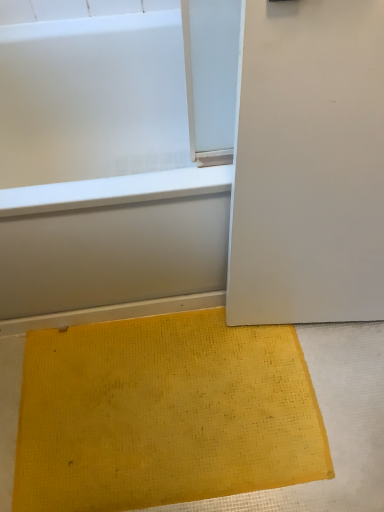
Question: Considering the positions of white glossy bathtub at lower left and yellow woven mat at lower center in the image, is white glossy bathtub at lower left taller or shorter than yellow woven mat at lower center?

Choices:
 (A) tall
 (B) short

Answer: (A)

Question: From a real-world perspective, is white glossy bathtub at lower left positioned above or below yellow woven mat at lower center?

Choices:
 (A) above
 (B) below

Answer: (A)

Question: Does point (36, 219) appear closer or farther from the camera than point (46, 347)?

Choices:
 (A) farther
 (B) closer

Answer: (B)

Question: From a real-world perspective, is yellow woven mat at lower center above or below white glossy bathtub at lower left?

Choices:
 (A) below
 (B) above

Answer: (A)

Question: Is point pos(168,494) positioned closer to the camera than point pos(182,69)?

Choices:
 (A) closer
 (B) farther

Answer: (A)

Question: In terms of height, does yellow woven mat at lower center look taller or shorter compared to white glossy bathtub at lower left?

Choices:
 (A) short
 (B) tall

Answer: (A)

Question: In terms of size, does yellow woven mat at lower center appear bigger or smaller than white glossy bathtub at lower left?

Choices:
 (A) small
 (B) big

Answer: (A)